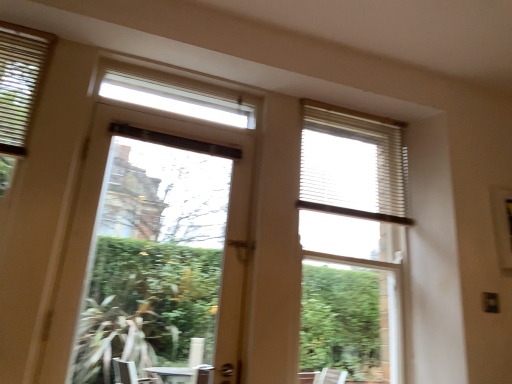
Question: From a real-world perspective, is white textured blind at upper right beneath matte white blinds at upper left?

Choices:
 (A) no
 (B) yes

Answer: (B)

Question: Is matte white blinds at upper left at the back of white textured blind at upper right?

Choices:
 (A) no
 (B) yes

Answer: (A)

Question: From the image's perspective, is white textured blind at upper right located beneath matte white blinds at upper left?

Choices:
 (A) yes
 (B) no

Answer: (A)

Question: Is white textured blind at upper right touching matte white blinds at upper left?

Choices:
 (A) yes
 (B) no

Answer: (B)

Question: Considering the relative sizes of white textured blind at upper right and matte white blinds at upper left in the image provided, is white textured blind at upper right taller than matte white blinds at upper left?

Choices:
 (A) no
 (B) yes

Answer: (B)

Question: From a real-world perspective, is white textured blind at upper right physically above matte white blinds at upper left?

Choices:
 (A) no
 (B) yes

Answer: (A)

Question: From a real-world perspective, is matte white blinds at upper left under white textured blinds at upper right?

Choices:
 (A) no
 (B) yes

Answer: (A)

Question: Is matte white blinds at upper left outside of white textured blinds at upper right?

Choices:
 (A) no
 (B) yes

Answer: (B)

Question: Is matte white blinds at upper left positioned before white textured blinds at upper right?

Choices:
 (A) no
 (B) yes

Answer: (B)

Question: Is matte white blinds at upper left oriented towards white textured blinds at upper right?

Choices:
 (A) yes
 (B) no

Answer: (B)

Question: Can you confirm if matte white blinds at upper left is shorter than white textured blinds at upper right?

Choices:
 (A) no
 (B) yes

Answer: (B)

Question: Is matte white blinds at upper left taller than white textured blinds at upper right?

Choices:
 (A) yes
 (B) no

Answer: (B)

Question: Is white textured blind at upper right thinner than white textured blinds at upper right?

Choices:
 (A) yes
 (B) no

Answer: (A)